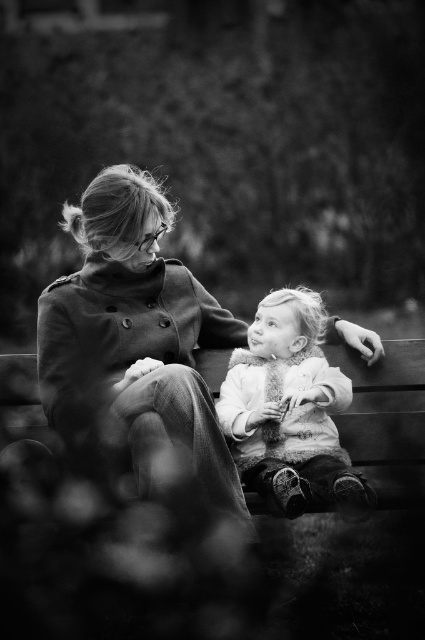
Question: Does coated fabric coat at center appear on the right side of fuzzy white coat at center?

Choices:
 (A) yes
 (B) no

Answer: (B)

Question: Is coated fabric coat at center further to the viewer compared to fuzzy white coat at center?

Choices:
 (A) yes
 (B) no

Answer: (B)

Question: Is coated fabric coat at center bigger than fuzzy white coat at center?

Choices:
 (A) no
 (B) yes

Answer: (B)